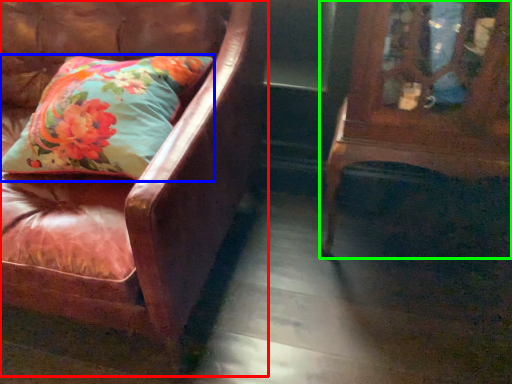
Question: Which object is positioned closest to chair (highlighted by a red box)? Select from pillow (highlighted by a blue box) and furniture (highlighted by a green box).

Choices:
 (A) pillow
 (B) furniture

Answer: (A)